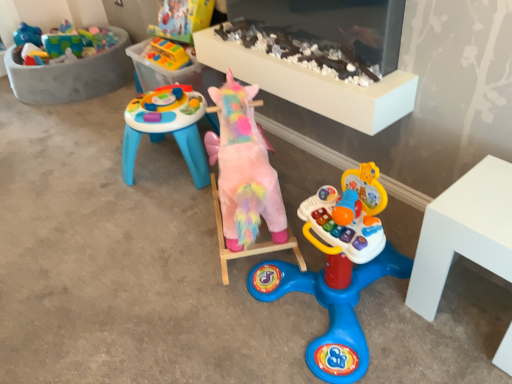
Question: Is rubberized plastic toy at upper center, acting as the third toy starting from the bottom, bigger or smaller than fluffy pink unicorn at center, which is the 1th toy from bottom to top?

Choices:
 (A) big
 (B) small

Answer: (B)

Question: Is rubberized plastic toy at upper center, acting as the third toy starting from the bottom, situated inside fluffy pink unicorn at center, the third toy positioned from the top, or outside?

Choices:
 (A) inside
 (B) outside

Answer: (B)

Question: Estimate the real-world distances between objects in this image. Which object is closer to the fluffy pink unicorn at center, the third toy positioned from the top?

Choices:
 (A) pastel plush unicorn at center, positioned as the 2th toy in top-to-bottom order
 (B) rubberized plastic toy at upper center, which is the 1th toy in top-to-bottom order

Answer: (A)

Question: Which object is positioned farthest from the fluffy pink unicorn at center, which is the 1th toy from bottom to top?

Choices:
 (A) rubberized plastic toy at upper center, acting as the third toy starting from the bottom
 (B) pastel plush unicorn at center, marked as the second toy in a bottom-to-top arrangement

Answer: (A)